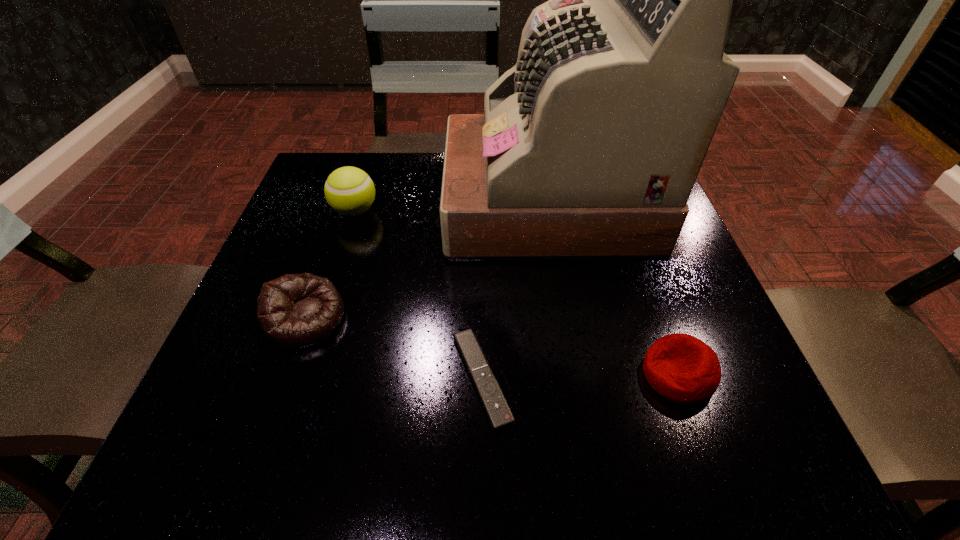
I want to click on vacant region that satisfies the following two spatial constraints: 1. on the operating side of the cash register; 2. on the front side of the tennis ball, so click(548, 211).